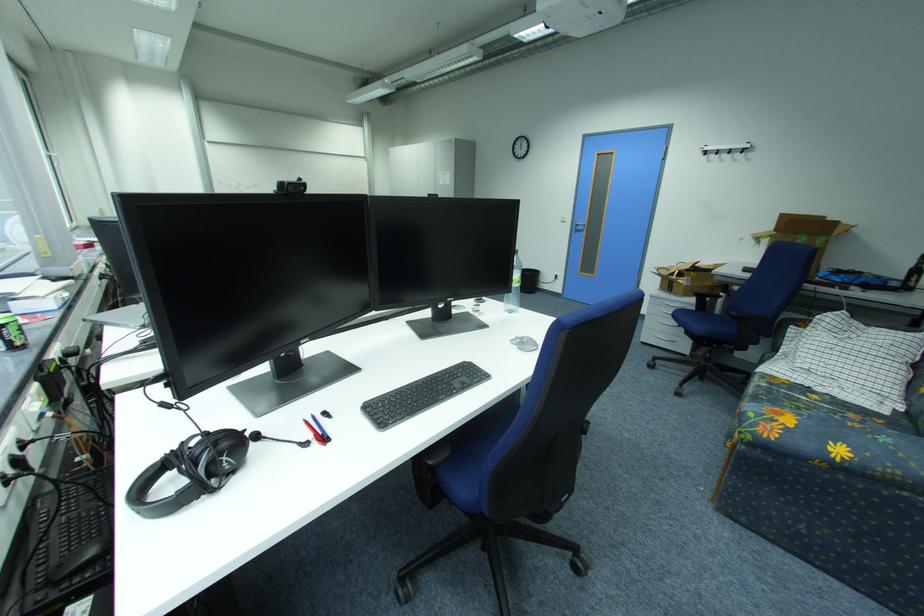
The image size is (924, 616). What are the coordinates of `clear water bottle` in the screenshot? It's located at (514, 286).